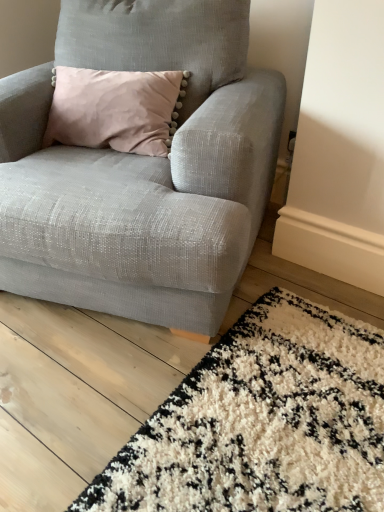
Question: Considering the positions of white shaggy rug at lower right and textured gray armchair at center in the image, is white shaggy rug at lower right wider or thinner than textured gray armchair at center?

Choices:
 (A) wide
 (B) thin

Answer: (A)

Question: Does point (294, 328) appear closer or farther from the camera than point (213, 131)?

Choices:
 (A) farther
 (B) closer

Answer: (A)

Question: Is white shaggy rug at lower right inside the boundaries of textured gray armchair at center, or outside?

Choices:
 (A) outside
 (B) inside

Answer: (A)

Question: From the image's perspective, is textured gray armchair at center above or below white shaggy rug at lower right?

Choices:
 (A) below
 (B) above

Answer: (B)

Question: In terms of height, does textured gray armchair at center look taller or shorter compared to white shaggy rug at lower right?

Choices:
 (A) tall
 (B) short

Answer: (A)

Question: Which is correct: textured gray armchair at center is inside white shaggy rug at lower right, or outside of it?

Choices:
 (A) inside
 (B) outside

Answer: (B)

Question: In terms of width, does textured gray armchair at center look wider or thinner when compared to white shaggy rug at lower right?

Choices:
 (A) thin
 (B) wide

Answer: (A)